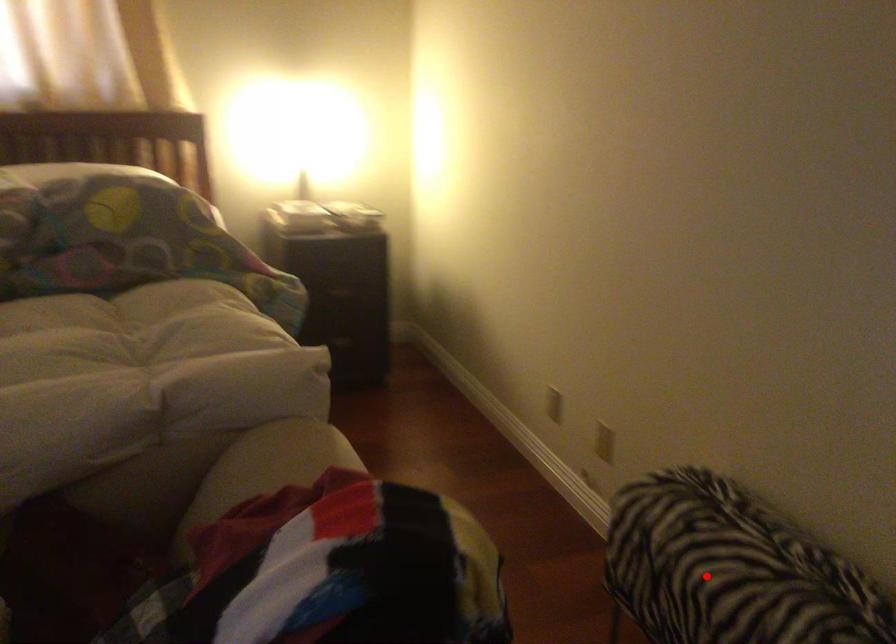
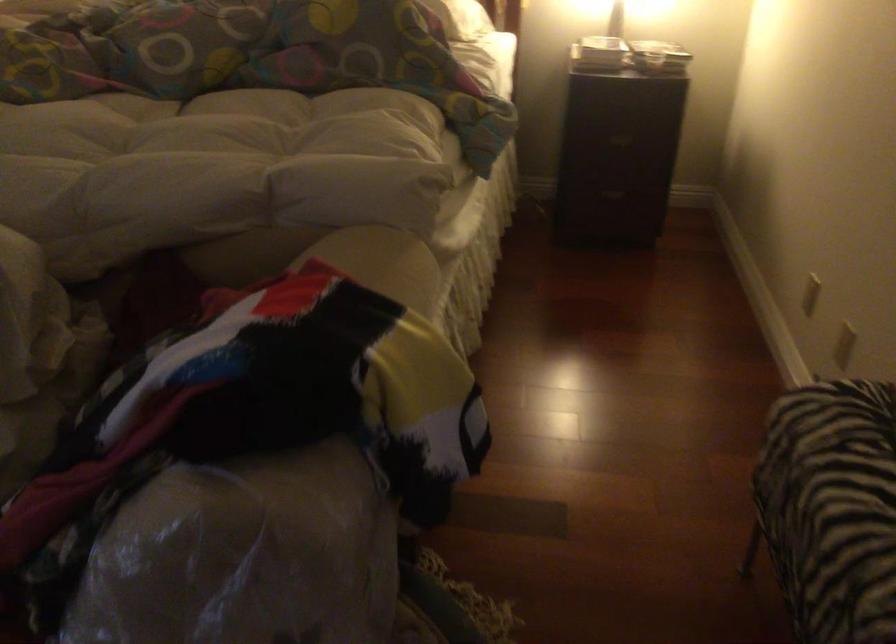
In the second image, find the point that corresponds to the highlighted location in the first image.

(831, 507)